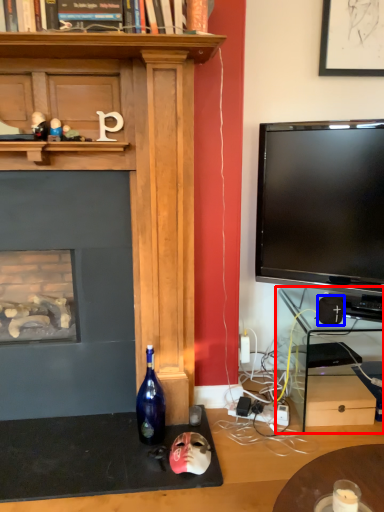
Question: Which object appears farthest to the camera in this image, computer desk (highlighted by a red box) or speaker (highlighted by a blue box)?

Choices:
 (A) computer desk
 (B) speaker

Answer: (A)